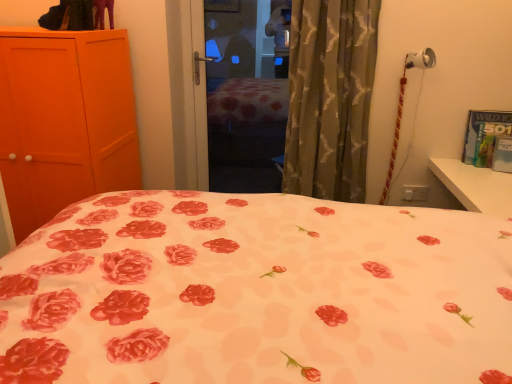
Question: From a real-world perspective, is green textured curtain at right physically located above or below matte red and white striped table lamp at upper right?

Choices:
 (A) below
 (B) above

Answer: (B)

Question: Visually, is green textured curtain at right positioned to the left or to the right of matte red and white striped table lamp at upper right?

Choices:
 (A) left
 (B) right

Answer: (A)

Question: In terms of height, does green textured curtain at right look taller or shorter compared to matte red and white striped table lamp at upper right?

Choices:
 (A) tall
 (B) short

Answer: (A)

Question: Is matte red and white striped table lamp at upper right spatially inside green textured curtain at right, or outside of it?

Choices:
 (A) outside
 (B) inside

Answer: (A)

Question: From a real-world perspective, is matte red and white striped table lamp at upper right above or below green textured curtain at right?

Choices:
 (A) below
 (B) above

Answer: (A)

Question: Is point (433, 62) positioned closer to the camera than point (316, 59)?

Choices:
 (A) farther
 (B) closer

Answer: (A)

Question: Looking at their shapes, would you say matte red and white striped table lamp at upper right is wider or thinner than green textured curtain at right?

Choices:
 (A) thin
 (B) wide

Answer: (A)